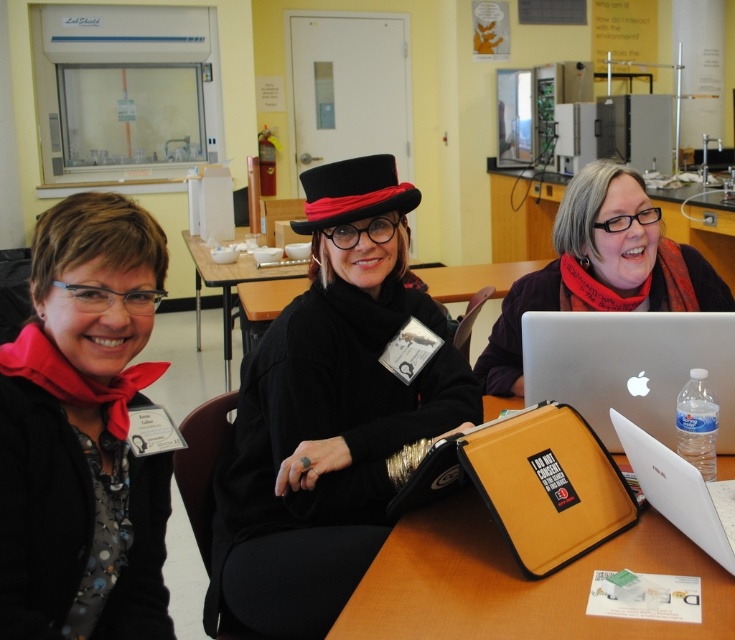
You are sitting at the table with the three people and need to reach for the silver metallic laptop at center to check an email. However, you must avoid touching the black felt hat at center. Which direction should you move your hand to safely grab the laptop without disturbing the hat?

The silver metallic laptop at center is to the right of the black felt hat at center. To safely grab the laptop without disturbing the hat, move your hand to the right side of the hat.

You are organizing a presentation and need to place both the silver metallic laptop at center and the black felt hat at center on a shelf. Which item should be placed first if you want to ensure both fit without adjusting their positions?

The black felt hat at center should be placed first because it is shorter than the silver metallic laptop at center, allowing the taller laptop to be placed behind or beside it without obstruction.

You are a photographer trying to capture a clear shot of the matte black laptop at center without the black matte hat at center blocking it. Based on their positions, which side of the table should you position yourself to ensure the hat doesn t obstruct the view?

The black matte hat at center is on the left side of the matte black laptop at center, so positioning yourself to the right side of the table would allow you to see the matte black laptop at center without the hat obstructing the view.